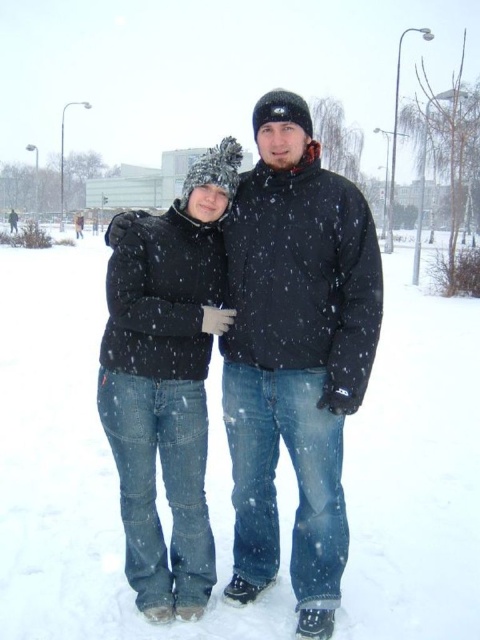
You are standing in a snowy area and see a point at coordinates (296, 355). What object is located at that point?

The point at coordinates (296, 355) corresponds to the matte black jacket at center.

You are a photographer setting up a shot of the two people in the image. You want to ensure that the matte black jacket at center and the black puffy jacket at left are both in focus. Which jacket should you focus on first to ensure both are sharp?

The matte black jacket at center is above the black puffy jacket at left, so focusing on the matte black jacket at center first will help ensure both are in focus as it is closer to the camera.